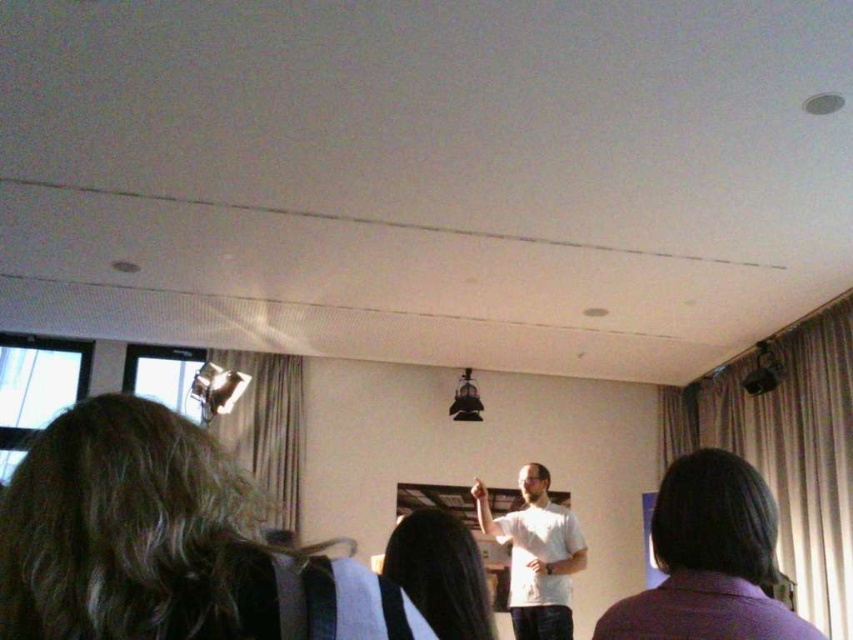
Is point (64, 618) positioned after point (416, 602)?

No, it is in front of (416, 602).

Between dark brown hair at lower left and smooth black hair at center, which one is positioned lower?

smooth black hair at center

The width and height of the screenshot is (853, 640). What are the coordinates of `dark brown hair at lower left` in the screenshot? It's located at (165, 544).

I want to click on dark brown hair at lower left, so click(x=165, y=544).

The height and width of the screenshot is (640, 853). Describe the element at coordinates (709, 560) in the screenshot. I see `purple fabric hair at lower right` at that location.

Between purple fabric hair at lower right and smooth black hair at center, which one is positioned lower?

smooth black hair at center is below.

What are the coordinates of `purple fabric hair at lower right` in the screenshot? It's located at (709, 560).

Is point (84, 442) farther from camera compared to point (519, 484)?

No, it is not.

The width and height of the screenshot is (853, 640). Describe the element at coordinates (165, 544) in the screenshot. I see `dark brown hair at lower left` at that location.

The image size is (853, 640). In order to click on dark brown hair at lower left in this screenshot , I will do `click(165, 544)`.